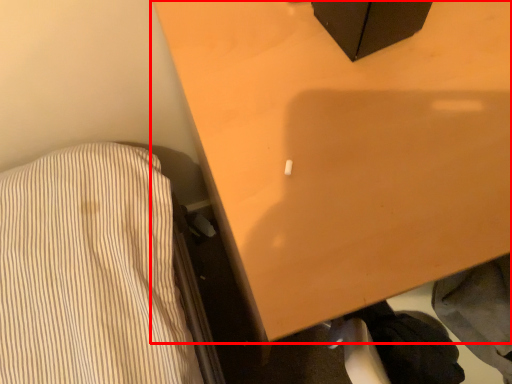
Question: From the image's perspective, where is furniture (annotated by the red box) located in relation to clothing in the image?

Choices:
 (A) below
 (B) above

Answer: (B)